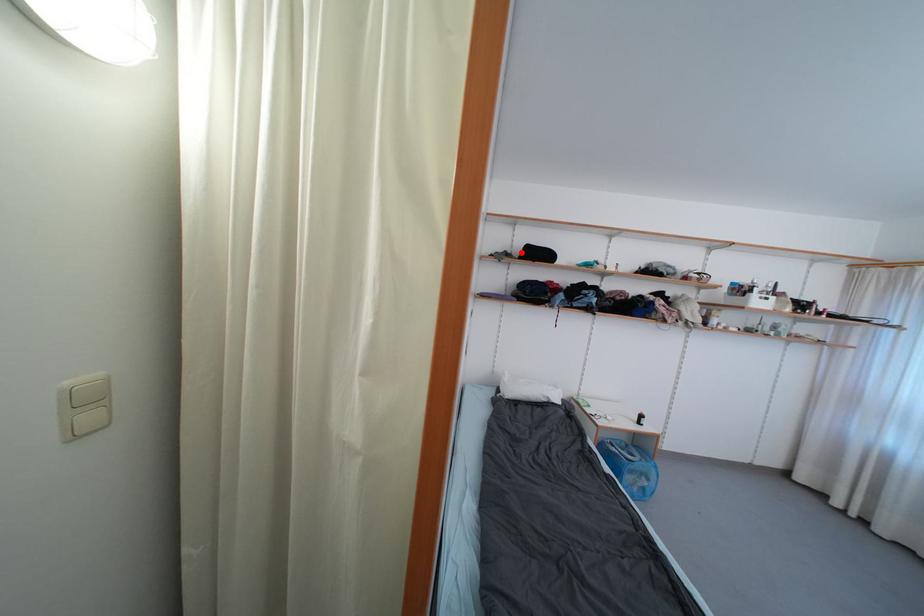
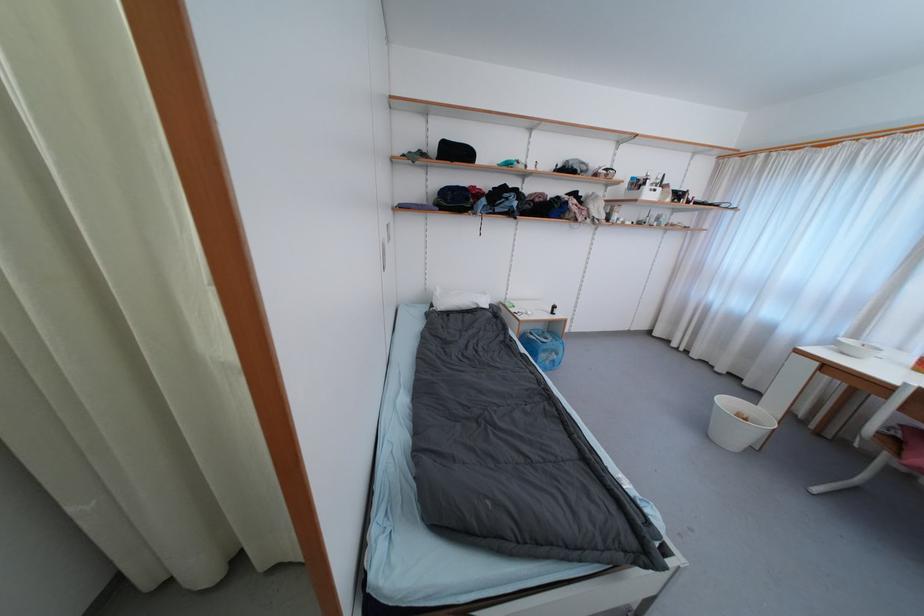
Where in the second image is the point corresponding to the highlighted location from the first image?

(438, 151)